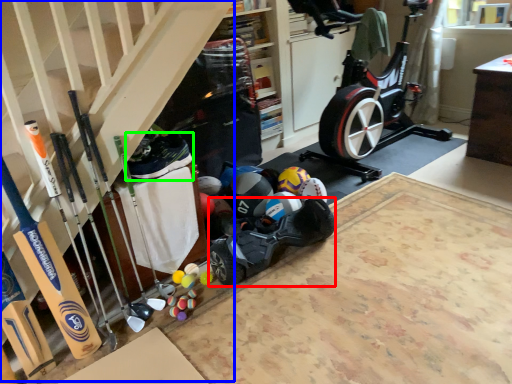
Question: Which object is positioned farthest from car (highlighted by a red box)? Select from stairs (highlighted by a blue box) and shoe (highlighted by a green box).

Choices:
 (A) stairs
 (B) shoe

Answer: (A)